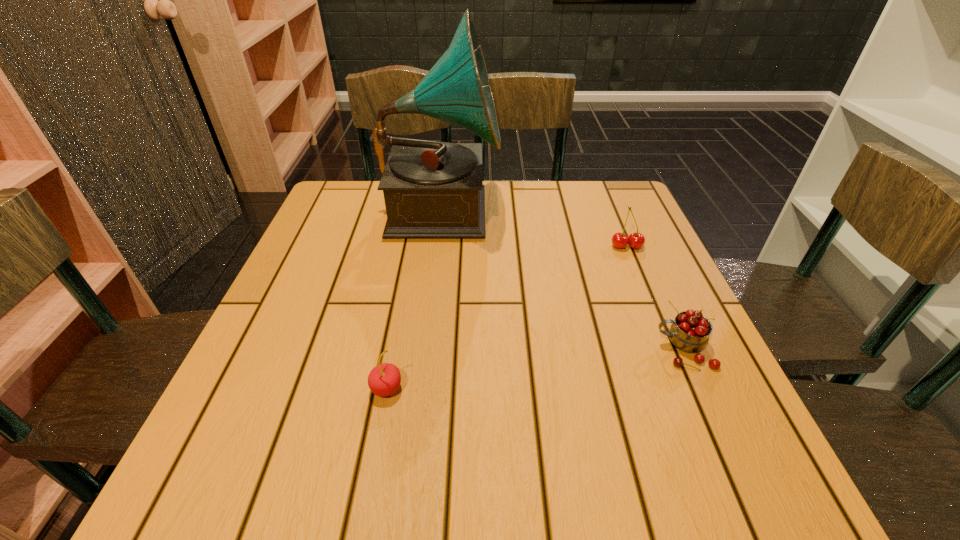
Find the location of `record player`. record player is located at coordinates (431, 189).

Locate an element on the screen. The height and width of the screenshot is (540, 960). the tallest object is located at coordinates (431, 189).

At what (x,y) coordinates should I click in order to perform the action: click on the second farthest object. Please return your answer as a coordinate pair (x, y). Image resolution: width=960 pixels, height=540 pixels. Looking at the image, I should click on (636, 240).

Identify the location of the nearest object. (384, 379).

Find the location of a particular element. the nearest cherry is located at coordinates (384, 379).

Where is `the second farthest cherry`? the second farthest cherry is located at coordinates (690, 331).

Where is `vacant space located on the horn of the record player`? vacant space located on the horn of the record player is located at coordinates (536, 208).

I want to click on vacant space situated 0.220m with the stems of the second farthest object pointing upwards, so click(x=657, y=320).

The image size is (960, 540). Identify the location of free spot located 0.190m on the right of the leftmost cherry. (514, 388).

At what (x,y) coordinates should I click in order to perform the action: click on blank space located 0.400m on the handle side of the second nearest object. Please return your answer as a coordinate pair (x, y). The image size is (960, 540). Looking at the image, I should click on (441, 349).